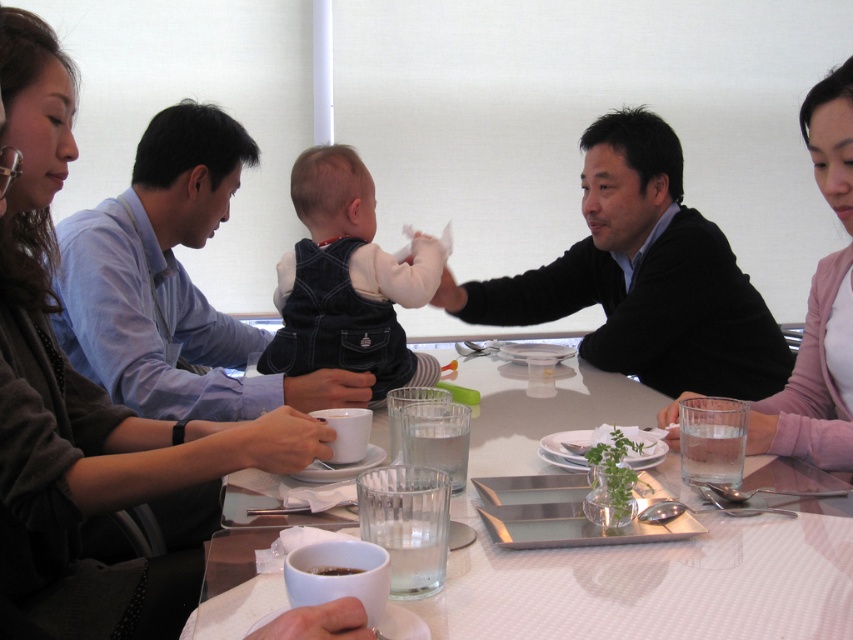
Question: Among these objects, which one is farthest from the camera?

Choices:
 (A) black sweater at center
 (B) denim overalls at center
 (C) blue denim shirt at upper left
 (D) dark brown glossy coffee cup at lower center

Answer: (A)

Question: Is white glossy mug at lower center bigger than denim overalls at center?

Choices:
 (A) yes
 (B) no

Answer: (A)

Question: Is denim overalls at center smaller than dark brown glossy coffee cup at lower center?

Choices:
 (A) no
 (B) yes

Answer: (A)

Question: Does blue denim shirt at upper left have a larger size compared to pink fabric shirt at upper right?

Choices:
 (A) yes
 (B) no

Answer: (A)

Question: Which object is farther from the camera taking this photo?

Choices:
 (A) blue denim shirt at upper left
 (B) dark brown glossy coffee cup at lower center
 (C) green leafy plant at center
 (D) matte black jacket at left

Answer: (A)

Question: Among these points, which one is farthest from the camera?

Choices:
 (A) (828, 125)
 (B) (306, 198)

Answer: (B)